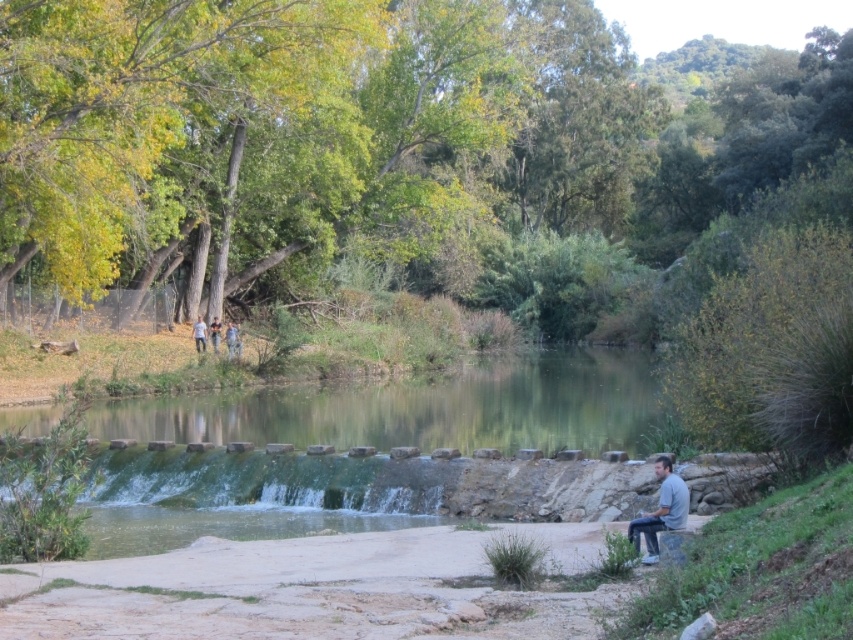
Question: Considering the real-world distances, which object is farthest from the gray cotton shirt at lower right?

Choices:
 (A) light brown leather jacket at upper center
 (B) light blue jeans at center
 (C) clear water at center
 (D) light brown leather jacket at center

Answer: (B)

Question: Is light brown leather jacket at upper center bigger than light blue jeans at center?

Choices:
 (A) no
 (B) yes

Answer: (B)

Question: Does light brown leather jacket at upper center appear on the right side of light blue jeans at center?

Choices:
 (A) yes
 (B) no

Answer: (A)

Question: Which object is closer to the camera taking this photo?

Choices:
 (A) light brown leather jacket at center
 (B) light brown leather jacket at upper center

Answer: (B)

Question: Is clear water at center to the right of light brown leather jacket at center from the viewer's perspective?

Choices:
 (A) no
 (B) yes

Answer: (B)

Question: Estimate the real-world distances between objects in this image. Which object is closer to the light brown leather jacket at upper center?

Choices:
 (A) gray cotton shirt at lower right
 (B) clear water at center
 (C) light blue jeans at center
 (D) light brown leather jacket at center

Answer: (D)